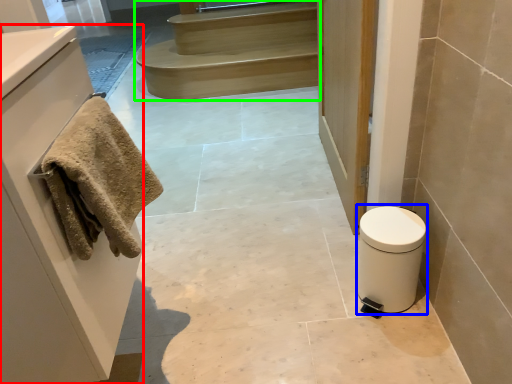
Question: Which is farther away from cabinetry (highlighted by a red box)? toilet bowl (highlighted by a blue box) or stairs (highlighted by a green box)?

Choices:
 (A) toilet bowl
 (B) stairs

Answer: (B)